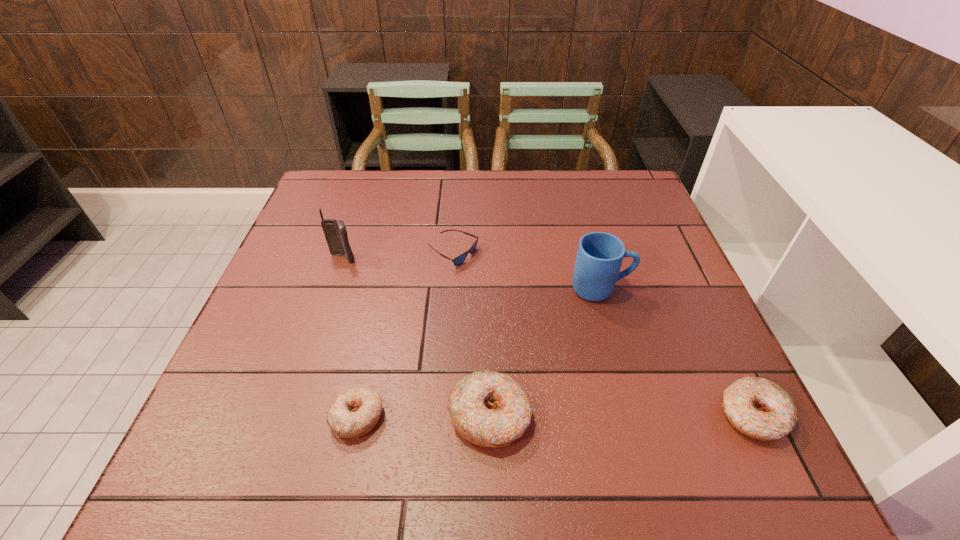
The image size is (960, 540). I want to click on vacant position for inserting another doughnut evenly, so click(x=621, y=415).